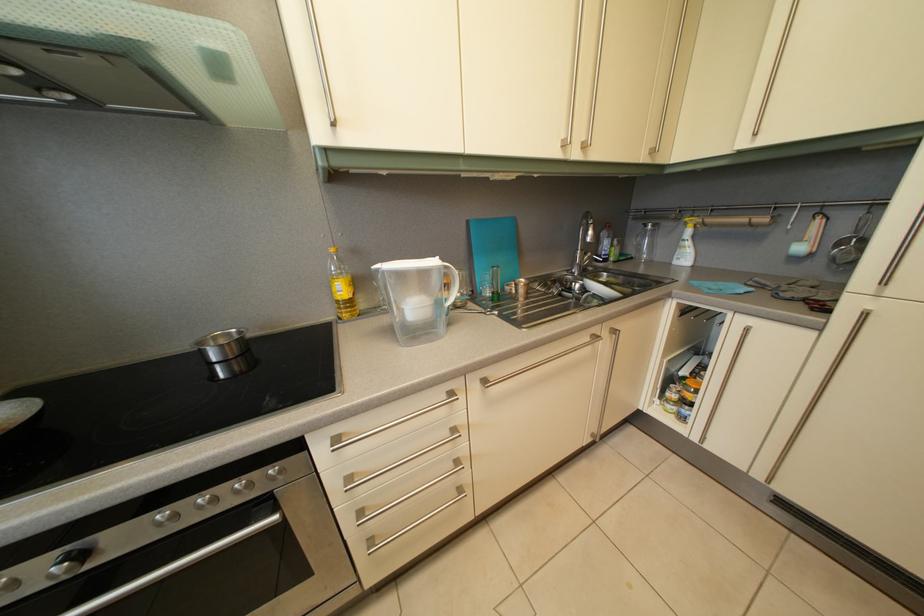
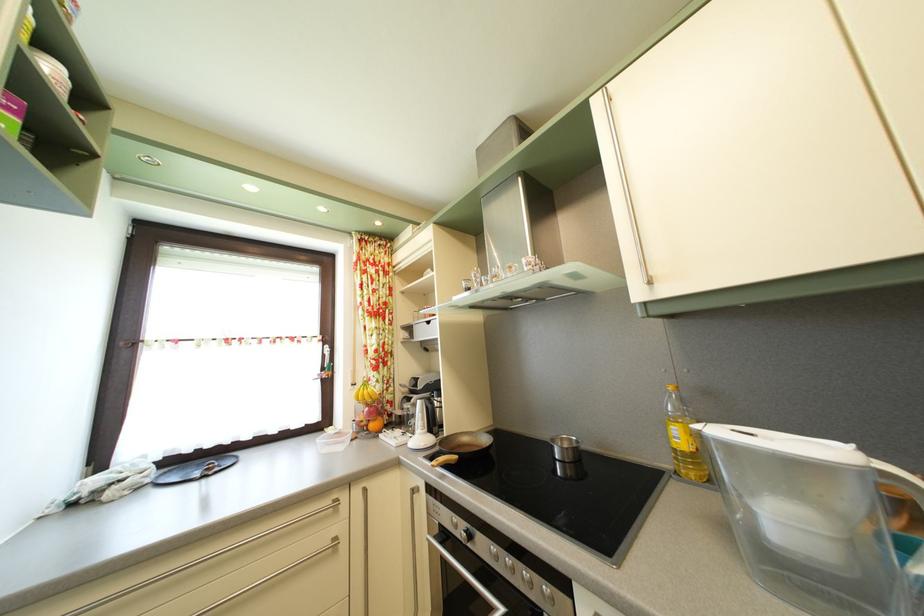
The point at (224, 346) is marked in the first image. Where is the corresponding point in the second image?

(569, 448)